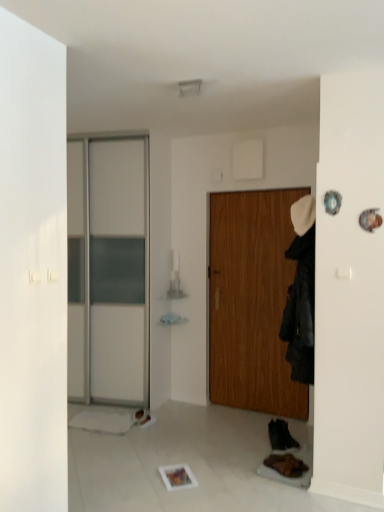
Question: Is white leather shoe at lower center, which ranks as the 1th shoe in left-to-right order, in front of or behind black leather shoe at lower right, the 1th shoe from the right, in the image?

Choices:
 (A) front
 (B) behind

Answer: (B)

Question: Is white leather shoe at lower center, which ranks as the 1th shoe in left-to-right order, inside or outside of black leather shoe at lower right, which appears as the 3th shoe when viewed from the left?

Choices:
 (A) outside
 (B) inside

Answer: (A)

Question: Which of these objects is positioned farthest from the wooden door at center?

Choices:
 (A) white leather shoe at lower center, the 3th shoe positioned from the front
 (B) black leather shoe at lower right, arranged as the second shoe when viewed from the back
 (C) brown suede shoe at lower right, marked as the third shoe in a back-to-front arrangement
 (D) black fabric coat at right

Answer: (A)

Question: Which object is the farthest from the white leather shoe at lower center, which ranks as the 1th shoe in left-to-right order?

Choices:
 (A) black leather shoe at lower right, which ranks as the 2th shoe in front-to-back order
 (B) wooden door at center
 (C) black fabric coat at right
 (D) brown suede shoe at lower right, which ranks as the 2th shoe in right-to-left order

Answer: (C)